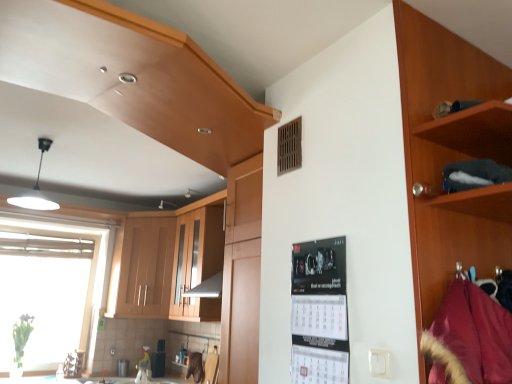
Question: Looking at their shapes, would you say dark brown wood at upper right is wider or thinner than white glossy countertop at lower center?

Choices:
 (A) thin
 (B) wide

Answer: (A)

Question: From the image's perspective, is dark brown wood at upper right positioned above or below white glossy countertop at lower center?

Choices:
 (A) above
 (B) below

Answer: (A)

Question: Estimate the real-world distances between objects in this image. Which object is closer to the wooden cabinet at upper left, arranged as the third cabinetry when viewed from the front?

Choices:
 (A) dark brown wood at upper right
 (B) wooden cabinet at right, which is the third cabinetry in back-to-front order
 (C) white plastic electric outlet at lower right
 (D) matte wood cabinet at center, the 2th cabinetry viewed from the left
 (E) velvet burgundy coat at right

Answer: (D)

Question: Which object is positioned farthest from the white plastic electric outlet at lower right?

Choices:
 (A) wooden cabinet at right, which is the third cabinetry in back-to-front order
 (B) matte wood cabinet at center, the second cabinetry positioned from the right
 (C) white glossy countertop at lower center
 (D) transparent glass window at left
 (E) velvet burgundy coat at right

Answer: (D)